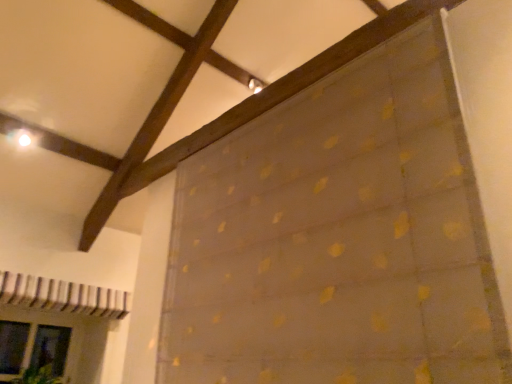
Question: Considering their positions, is translucent yellow dots at center located in front of or behind transparent glass door at lower left?

Choices:
 (A) behind
 (B) front

Answer: (B)

Question: From a real-world perspective, is translucent yellow dots at center above or below transparent glass door at lower left?

Choices:
 (A) below
 (B) above

Answer: (B)

Question: Is point (329, 233) closer or farther from the camera than point (50, 360)?

Choices:
 (A) farther
 (B) closer

Answer: (B)

Question: From the image's perspective, is transparent glass door at lower left above or below translucent yellow dots at center?

Choices:
 (A) below
 (B) above

Answer: (A)

Question: In the image, is transparent glass door at lower left on the left side or the right side of translucent yellow dots at center?

Choices:
 (A) right
 (B) left

Answer: (B)

Question: In terms of size, does transparent glass door at lower left appear bigger or smaller than translucent yellow dots at center?

Choices:
 (A) small
 (B) big

Answer: (A)

Question: Is point (28, 327) positioned closer to the camera than point (291, 304)?

Choices:
 (A) closer
 (B) farther

Answer: (B)